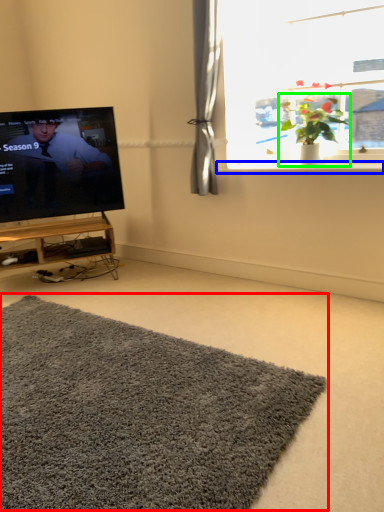
Question: Which object is the closest to the doormat (highlighted by a red box)? Choose among these: window sill (highlighted by a blue box) or houseplant (highlighted by a green box).

Choices:
 (A) window sill
 (B) houseplant

Answer: (A)